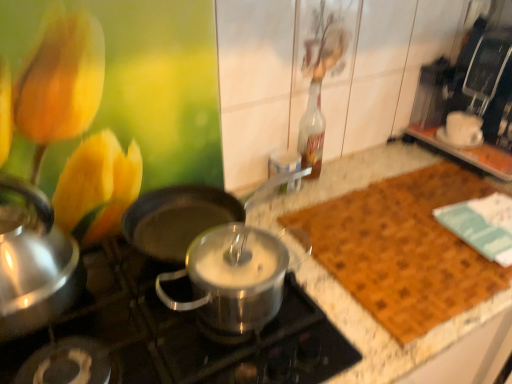
The image size is (512, 384). In order to click on vacant point above brown woven mat at right (from a real-world perspective) in this screenshot , I will do `click(425, 232)`.